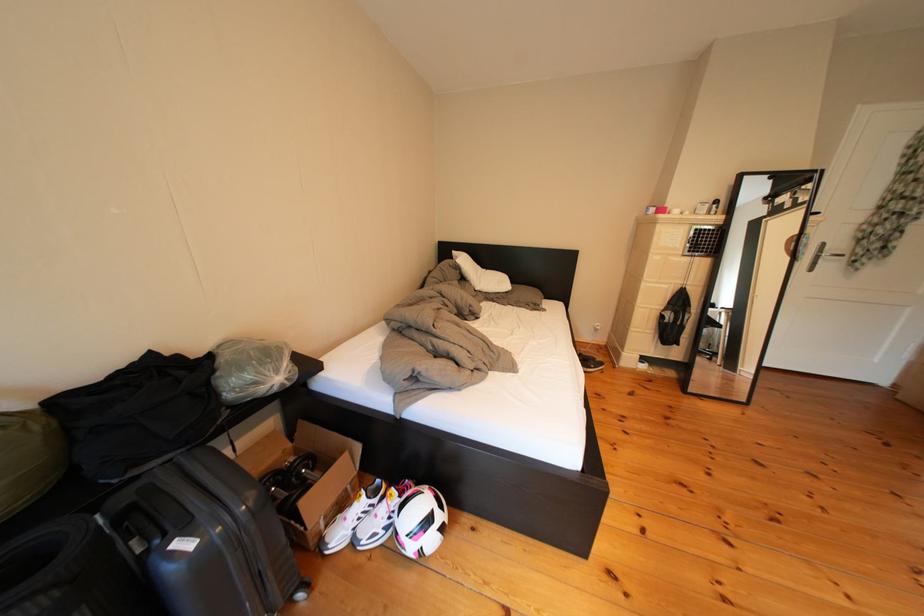
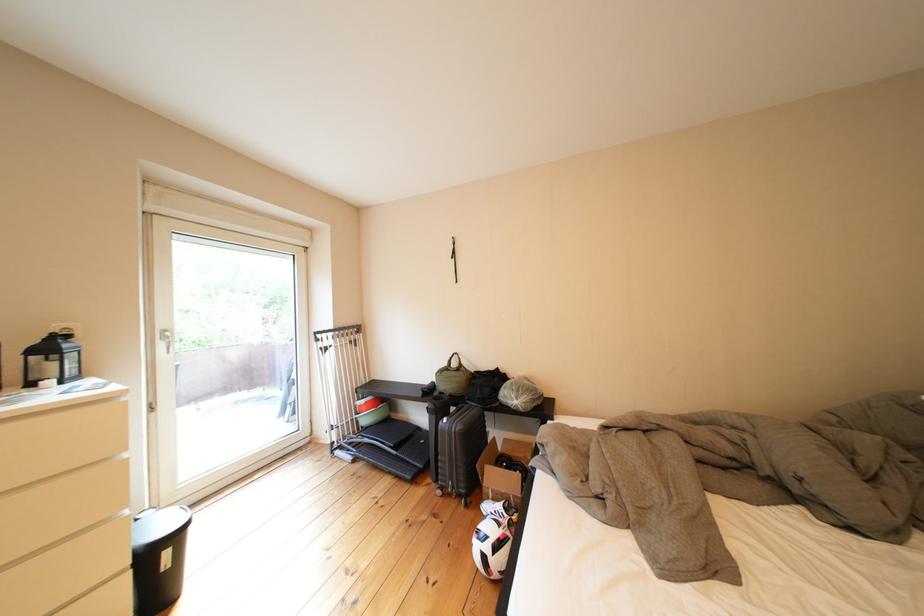
The point at (x=456, y=532) is marked in the first image. Where is the corresponding point in the second image?

(499, 562)